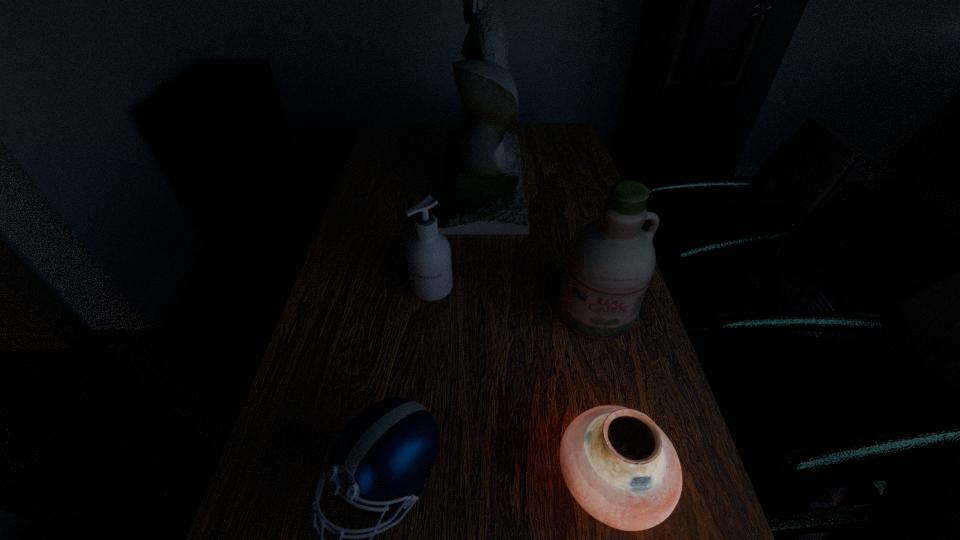
Where is `the farthest object`? This screenshot has height=540, width=960. the farthest object is located at coordinates (482, 193).

What are the coordinates of `sculpture` in the screenshot? It's located at (482, 193).

Find the location of a particular element. The width and height of the screenshot is (960, 540). the fourth shortest object is located at coordinates (610, 261).

Find the location of a particular element. the taller cleansing agent is located at coordinates (610, 261).

Locate an element on the screen. the left cleansing agent is located at coordinates (428, 251).

I want to click on the third tallest object, so click(x=428, y=251).

You are a GUI agent. You are given a task and a screenshot of the screen. Output one action in this format:
    pyautogui.click(x=<x>, y=<y>)
    Task: Click on the vacant position located on the base of the sculpture
    
    Given the screenshot: What is the action you would take?
    pyautogui.click(x=391, y=180)

The width and height of the screenshot is (960, 540). I want to click on blank area located on the base of the sculpture, so click(420, 180).

Where is `vacant space situated on the base of the sculpture`? vacant space situated on the base of the sculpture is located at coordinates (388, 180).

The image size is (960, 540). I want to click on free space located 0.210m on the front label of the taller cleansing agent, so click(624, 428).